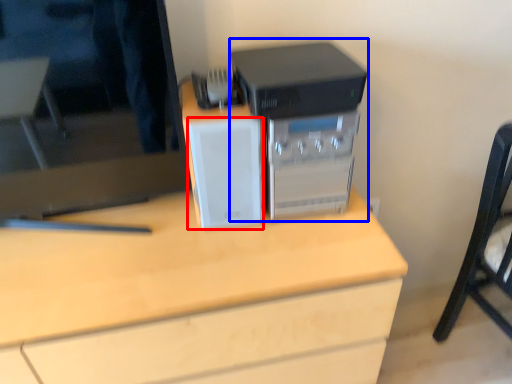
Question: Among these objects, which one is nearest to the camera, speaker (highlighted by a red box) or home appliance (highlighted by a blue box)?

Choices:
 (A) speaker
 (B) home appliance

Answer: (A)